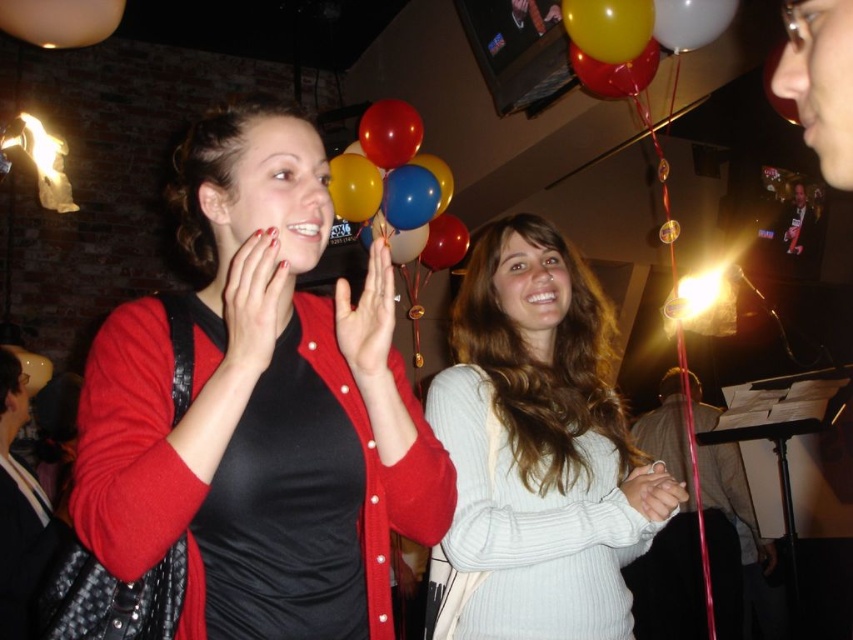
The height and width of the screenshot is (640, 853). In order to click on shiny metallic balloons at upper center in this screenshot , I will do (389, 132).

Which is more to the right, shiny metallic balloons at upper center or white glossy balloon at upper center?

white glossy balloon at upper center is more to the right.

The image size is (853, 640). In order to click on shiny metallic balloons at upper center in this screenshot , I will do `click(389, 132)`.

Between light gray sweater at center and yellow matte balloon at upper center, which one is positioned lower?

light gray sweater at center

Measure the distance between point (589, 408) and camera.

Point (589, 408) is 1.48 meters from camera.

Is point (543, 451) closer to viewer compared to point (653, 12)?

Yes, it is in front of point (653, 12).

Find the location of a particular element. Image resolution: width=853 pixels, height=640 pixels. light gray sweater at center is located at coordinates (537, 452).

Can you confirm if matte black sweater at center is positioned below white glossy balloon at upper center?

Indeed, matte black sweater at center is positioned under white glossy balloon at upper center.

Between point (131, 496) and point (671, 22), which one is positioned behind?

The point (671, 22) is behind.

Between point (167, 480) and point (663, 24), which one is positioned in front?

Positioned in front is point (167, 480).

Locate an element on the screen. This screenshot has height=640, width=853. matte black sweater at center is located at coordinates (260, 408).